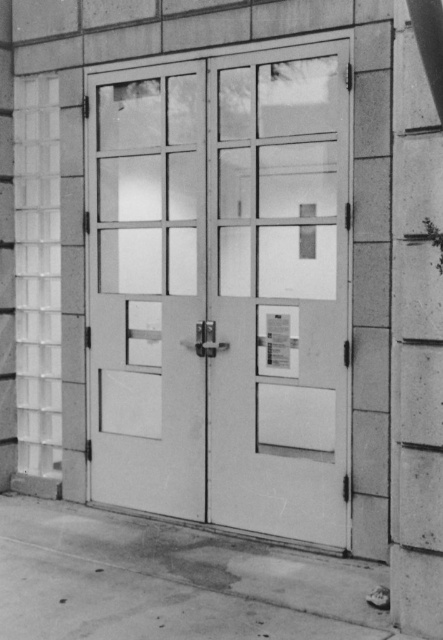
Question: Considering the real-world distances, which object is closest to the matte glass door at center?

Choices:
 (A) clear glass door at center
 (B) smooth concrete pillar at right

Answer: (A)

Question: Is matte glass door at center to the left of smooth concrete pillar at right from the viewer's perspective?

Choices:
 (A) no
 (B) yes

Answer: (B)

Question: Can you confirm if matte glass door at center is smaller than smooth concrete pillar at right?

Choices:
 (A) yes
 (B) no

Answer: (B)

Question: Among these points, which one is nearest to the camera?

Choices:
 (A) (158, 289)
 (B) (264, 294)
 (C) (396, 262)

Answer: (C)

Question: Can you confirm if clear glass door at center is positioned to the left of matte glass door at center?

Choices:
 (A) no
 (B) yes

Answer: (A)

Question: Which is farther from the matte glass door at center?

Choices:
 (A) clear glass door at center
 (B) smooth concrete pillar at right

Answer: (B)